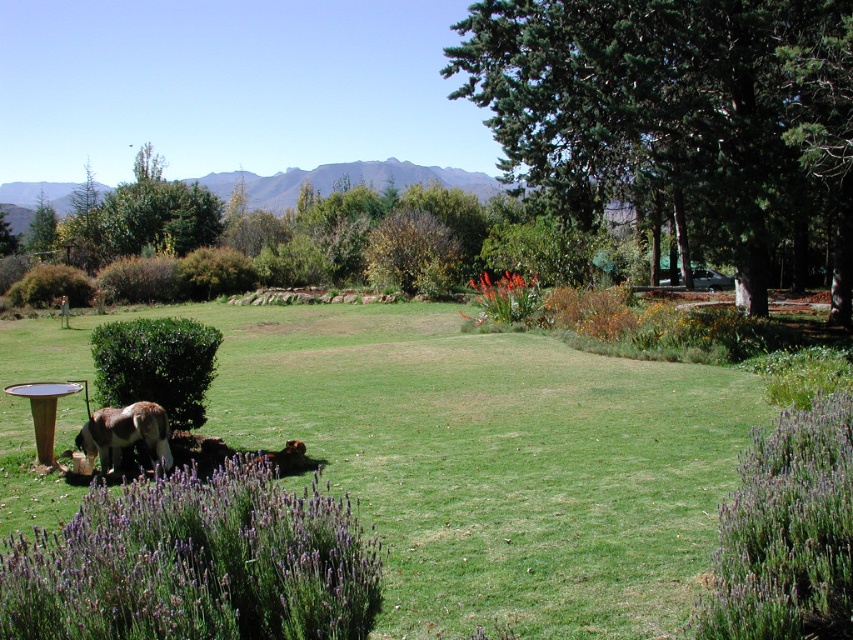
You are a gardener standing in the middle of the garden. You need to water both the green leafy tree at center right and the purple fuzzy bush at lower right. Which one should you water first if you want to start with the closer plant?

You should water the green leafy tree at center right first because it is closer to you than the purple fuzzy bush at lower right, as it is further away.

You are standing in the garden scene described. There is a point labeled at coordinates (786, 532). What object is located at this point?

The point at coordinates (786, 532) corresponds to the purple fuzzy bush at lower right.

You are standing in the garden and see the green grass at center and the brown furry dog at lower left. Which object is closer to you?

The brown furry dog at lower left is closer to you because it is positioned under the green grass at center, which is above it.